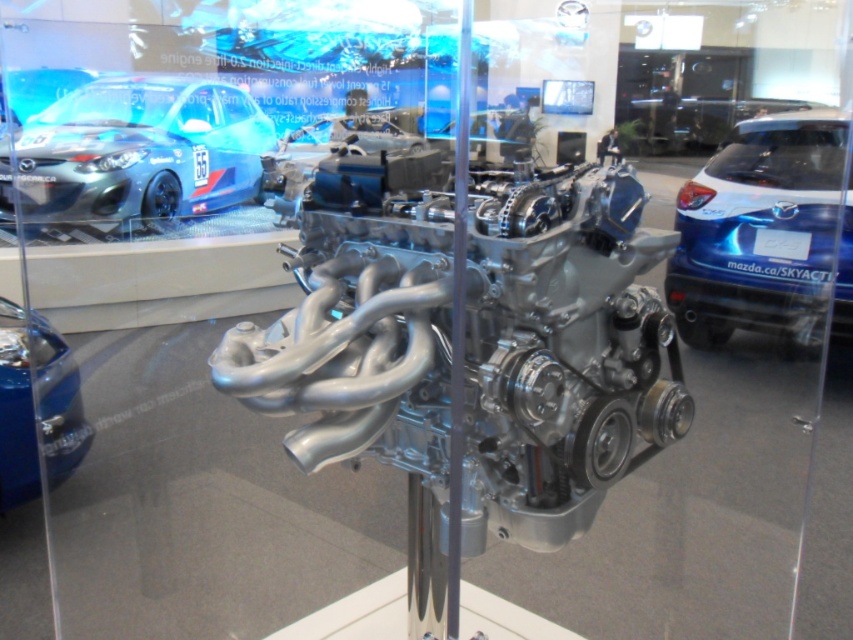
Question: Can you confirm if polished silver engine at center is thinner than shiny blue car at lower left?

Choices:
 (A) no
 (B) yes

Answer: (A)

Question: Estimate the real-world distances between objects in this image. Which object is closer to the metallic blue hatchback at right?

Choices:
 (A) polished silver engine at center
 (B) shiny blue car at lower left
 (C) matte blue car at upper left

Answer: (A)

Question: Can you confirm if metallic blue hatchback at right is smaller than shiny blue car at lower left?

Choices:
 (A) no
 (B) yes

Answer: (A)

Question: Which object appears farthest from the camera in this image?

Choices:
 (A) polished silver engine at center
 (B) metallic blue hatchback at right
 (C) matte blue car at upper left

Answer: (C)

Question: Which of the following is the farthest from the observer?

Choices:
 (A) (585, 198)
 (B) (142, 168)
 (C) (834, 230)

Answer: (B)

Question: Does metallic blue hatchback at right have a lesser width compared to shiny blue car at lower left?

Choices:
 (A) yes
 (B) no

Answer: (B)